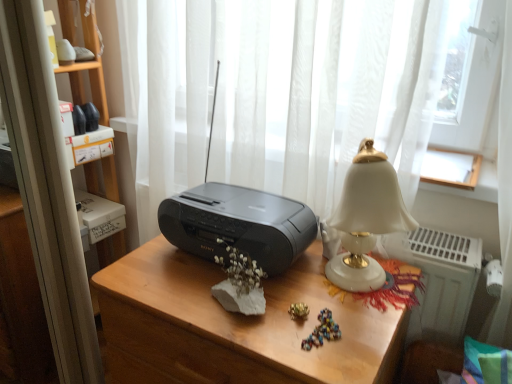
Where is `free space in front of black plastic printer at center`? This screenshot has height=384, width=512. free space in front of black plastic printer at center is located at coordinates (242, 315).